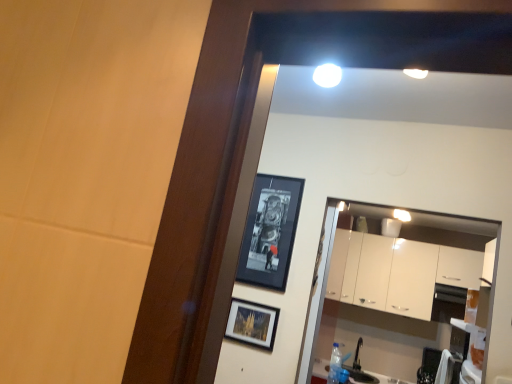
Question: Considering the positions of point (384, 264) and point (266, 337), is point (384, 264) closer or farther from the camera than point (266, 337)?

Choices:
 (A) closer
 (B) farther

Answer: (B)

Question: Would you say white glossy cabinets at center is inside or outside matte black picture frame at center, the second picture frame from the top?

Choices:
 (A) outside
 (B) inside

Answer: (A)

Question: Based on their relative distances, which object is nearer to the black glossy picture frame at upper center, which is counted as the second picture frame, starting from the bottom?

Choices:
 (A) white glossy cabinets at center
 (B) matte black picture frame at center, placed as the first picture frame when sorted from bottom to top

Answer: (B)

Question: Estimate the real-world distances between objects in this image. Which object is closer to the matte black picture frame at center, placed as the first picture frame when sorted from bottom to top?

Choices:
 (A) white glossy cabinets at center
 (B) black glossy picture frame at upper center, the first picture frame from the top

Answer: (B)